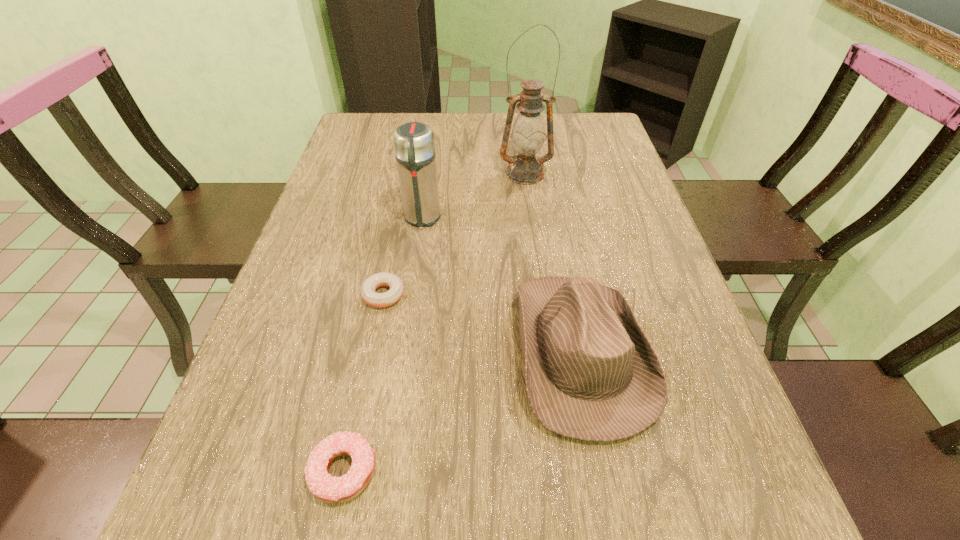
Identify the location of vacant space that is in between the fedora and the nearer doughnut. The width and height of the screenshot is (960, 540). (463, 411).

At what (x,y) coordinates should I click in order to perform the action: click on free spot between the tallest object and the shortest object. Please return your answer as a coordinate pair (x, y). The height and width of the screenshot is (540, 960). Looking at the image, I should click on (454, 234).

You are a GUI agent. You are given a task and a screenshot of the screen. Output one action in this format:
    pyautogui.click(x=<x>, y=<y>)
    Task: Click on the empty location between the thermos bottle and the oil lamp
    The image size is (960, 540).
    Given the screenshot: What is the action you would take?
    pyautogui.click(x=473, y=196)

The image size is (960, 540). In order to click on vacant space that's between the nearer doughnut and the tallest object in this screenshot , I will do `click(434, 322)`.

This screenshot has width=960, height=540. What are the coordinates of `free space that is in between the shorter doughnut and the taller doughnut` in the screenshot? It's located at (364, 383).

In order to click on vacant point located between the oil lamp and the taller doughnut in this screenshot , I will do `click(434, 322)`.

Identify the location of empty location between the third shortest object and the shorter doughnut. Image resolution: width=960 pixels, height=540 pixels. (483, 323).

Locate an element on the screen. The width and height of the screenshot is (960, 540). unoccupied position between the taller doughnut and the oil lamp is located at coordinates (434, 322).

Where is `blank region between the fedora and the farther doughnut`? This screenshot has width=960, height=540. blank region between the fedora and the farther doughnut is located at coordinates (483, 323).

Identify the location of object that stands as the closest to the second tallest object. (379, 300).